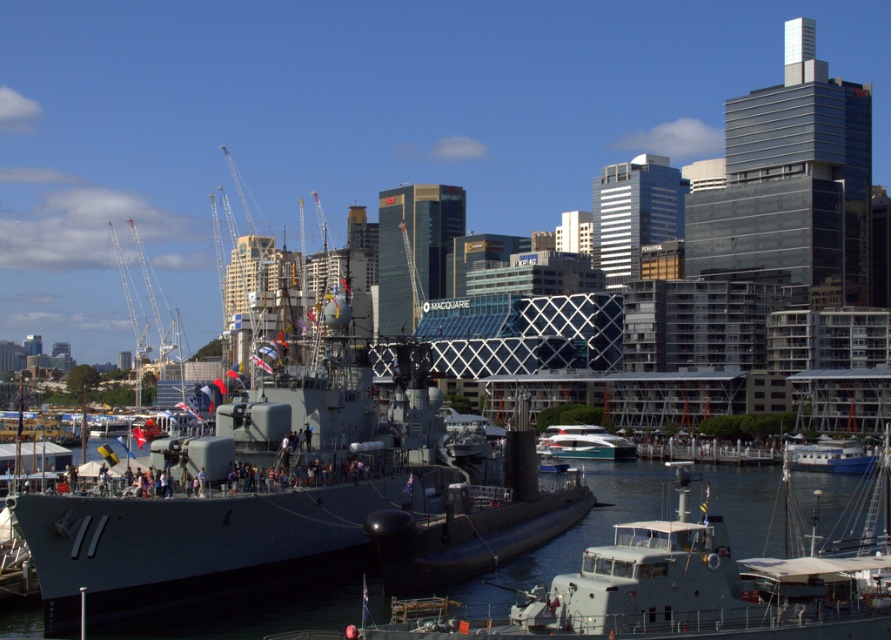
You are a photographer positioned at the harbor and want to capture both the white glossy yacht at center and the blue matte boat at lower right in a single frame. Which boat should you position closer to the left side of your camera viewfinder to include both in the shot?

To include both the white glossy yacht at center and the blue matte boat at lower right in the shot, position the white glossy yacht at center closer to the left side of your camera viewfinder since it is already to the left of the blue matte boat at lower right.

You are a photographer positioned on the dock and want to capture both the metallic gray boat at center and the white glossy yacht at center in a single shot. Based on their positions, which boat will appear closer to the camera in the photo?

The metallic gray boat at center will appear closer to the camera because it is positioned in front of the white glossy yacht at center.

You are a photographer aiming to capture the metallic gray boat at center and the blue matte boat at lower right in a single shot. Based on their positions, which boat would appear closer to the camera in the final photograph?

The metallic gray boat at center appears closer to the camera because it is positioned over the blue matte boat at lower right, indicating it is in front.